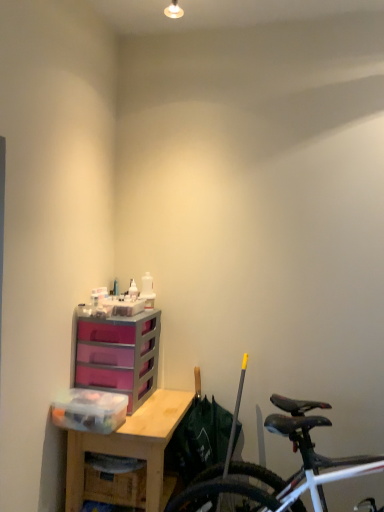
Question: Does point (206, 495) appear closer or farther from the camera than point (91, 396)?

Choices:
 (A) farther
 (B) closer

Answer: (B)

Question: From the image's perspective, is shiny black bicycle at lower right above or below transparent plastic storage box at left?

Choices:
 (A) above
 (B) below

Answer: (B)

Question: Which object is the closest to the purple plastic chest of drawers at center?

Choices:
 (A) transparent plastic storage box at left
 (B) shiny black bicycle at lower right
 (C) wooden desk at center

Answer: (A)

Question: Which of these objects is positioned farthest from the purple plastic chest of drawers at center?

Choices:
 (A) transparent plastic storage box at left
 (B) shiny black bicycle at lower right
 (C) wooden desk at center

Answer: (B)